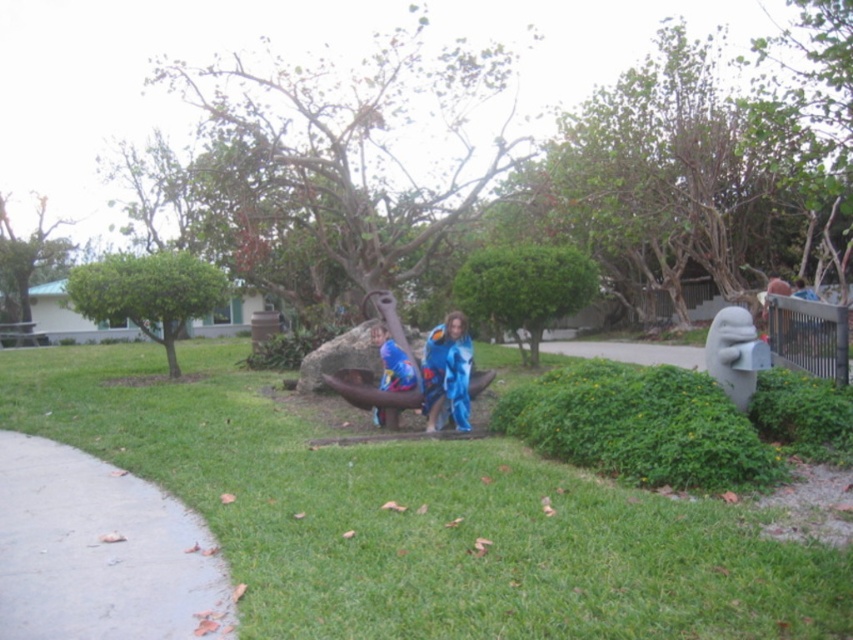
You are standing at the entrance of the park and see the green leafy hedge at upper left and the green leafy bush at center. Which one is closer to the ground?

The green leafy hedge at upper left is closer to the ground since it is positioned below the green leafy bush at center.

You are standing at the point marked by the coordinates (421, 518) in the image. What is the color of the ground beneath your feet?

The point marked by the coordinates (421, 518) is green grass at center, so the ground beneath your feet is green.